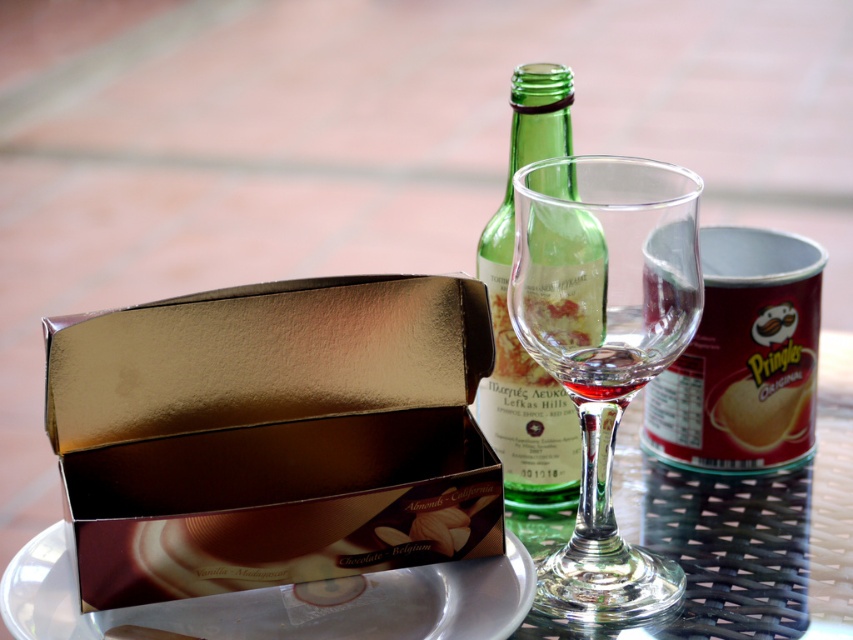
Can you confirm if white glossy plate at center is positioned to the left of matte gold box at center?

Yes, white glossy plate at center is to the left of matte gold box at center.

Does white glossy plate at center appear under matte gold box at center?

Yes, white glossy plate at center is below matte gold box at center.

Who is more forward, [323,624] or [756,417]?

Point [323,624] is more forward.

Where is `white glossy plate at center`? white glossy plate at center is located at coordinates (282, 602).

In the scene shown: Does transparent glass wine glass at center have a greater width compared to white glossy plate at center?

In fact, transparent glass wine glass at center might be narrower than white glossy plate at center.

Between transparent glass wine glass at center and white glossy plate at center, which one has less height?

Standing shorter between the two is white glossy plate at center.

The image size is (853, 640). Describe the element at coordinates (604, 344) in the screenshot. I see `transparent glass wine glass at center` at that location.

Find the location of a particular element. transparent glass wine glass at center is located at coordinates (604, 344).

Does white glossy plate at center appear over green glass bottle at center?

No, white glossy plate at center is not above green glass bottle at center.

Which is in front, point (479, 572) or point (531, 388)?

Point (479, 572)

Does point (337, 609) lie behind point (519, 125)?

No, (337, 609) is closer to viewer.

The width and height of the screenshot is (853, 640). Identify the location of white glossy plate at center. (282, 602).